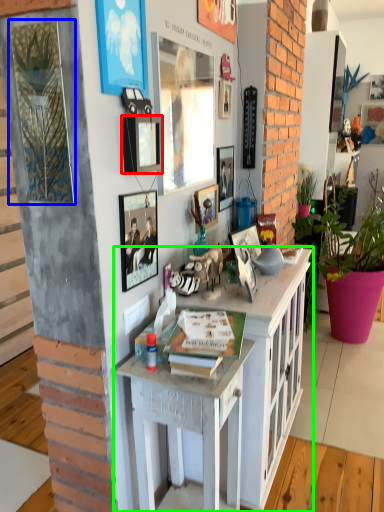
Question: Based on their relative distances, which object is farther from picture frame (highlighted by a red box)? Choose from picture frame (highlighted by a blue box) and cabinetry (highlighted by a green box).

Choices:
 (A) picture frame
 (B) cabinetry

Answer: (B)